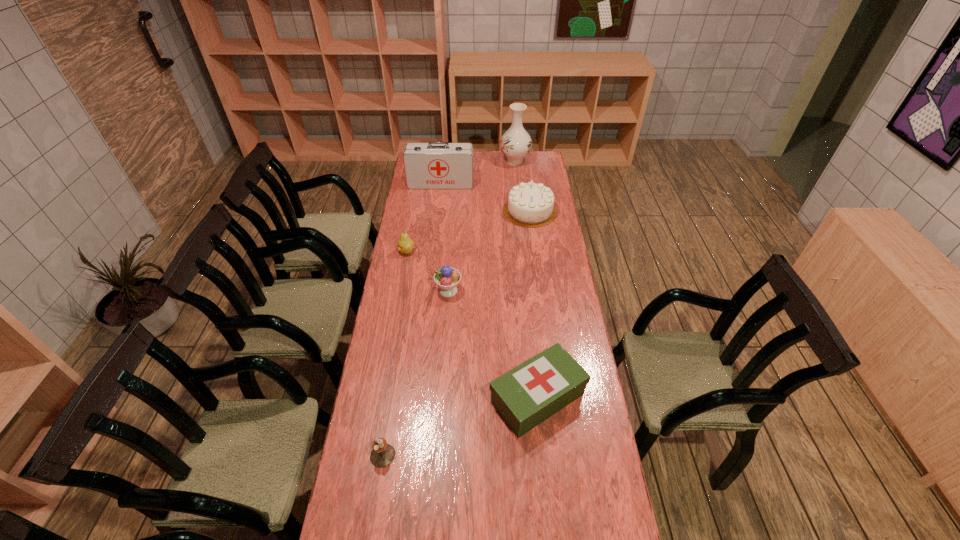
This screenshot has height=540, width=960. I want to click on free spot between the fifth farthest object and the birthday cake, so click(490, 251).

Find the location of a particular element. The width and height of the screenshot is (960, 540). vacant space that is in between the vase and the third nearest object is located at coordinates (482, 226).

Where is `unoccupied position between the third nearest object and the pear`? This screenshot has width=960, height=540. unoccupied position between the third nearest object and the pear is located at coordinates click(x=427, y=271).

This screenshot has height=540, width=960. I want to click on vacant area between the third farthest object and the pear, so click(x=468, y=231).

The width and height of the screenshot is (960, 540). I want to click on vacant space that is in between the vase and the left first-aid kit, so click(478, 172).

Select which object is the sixth closest to the icecream. Please provide its 2D coordinates. Your answer should be formatted as a tuple, i.e. [(x, y)], where the tuple contains the x and y coordinates of a point satisfying the conditions above.

[(516, 143)]

You are a GUI agent. You are given a task and a screenshot of the screen. Output one action in this format:
    pyautogui.click(x=<x>, y=<y>)
    Task: Click on the third closest object relative to the birthday cake
    The image size is (960, 540).
    Given the screenshot: What is the action you would take?
    (x=447, y=278)

Where is `vacant space that satisfies the following two spatial constraints: 1. on the back side of the candle holder; 2. on the right side of the icecream`? This screenshot has height=540, width=960. vacant space that satisfies the following two spatial constraints: 1. on the back side of the candle holder; 2. on the right side of the icecream is located at coordinates [x=409, y=291].